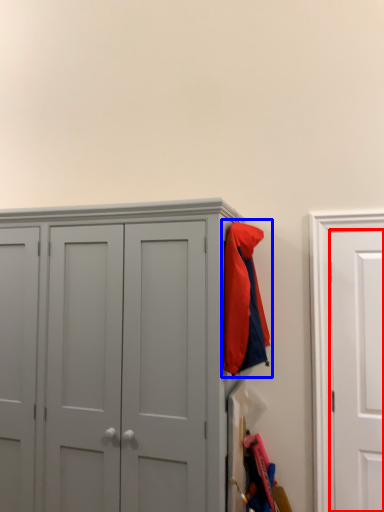
Question: Among these objects, which one is farthest to the camera, door (highlighted by a red box) or jacket (highlighted by a blue box)?

Choices:
 (A) door
 (B) jacket

Answer: (A)